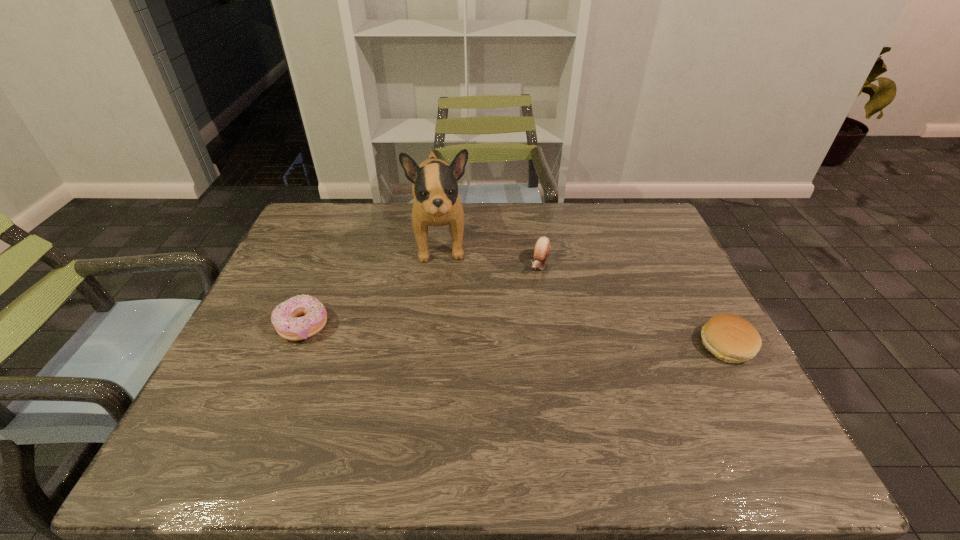
The width and height of the screenshot is (960, 540). I want to click on the leftmost object, so click(286, 319).

Locate an element on the screen. This screenshot has height=540, width=960. the rightmost object is located at coordinates (731, 338).

Image resolution: width=960 pixels, height=540 pixels. I want to click on escargot, so click(x=542, y=247).

Locate an element on the screen. Image resolution: width=960 pixels, height=540 pixels. the second tallest object is located at coordinates (542, 247).

Where is `the second object from left to right`? Image resolution: width=960 pixels, height=540 pixels. the second object from left to right is located at coordinates (436, 202).

You are a GUI agent. You are given a task and a screenshot of the screen. Output one action in this format:
    pyautogui.click(x=<x>, y=<y>)
    Task: Click on the puppy
    Image resolution: width=960 pixels, height=540 pixels.
    Given the screenshot: What is the action you would take?
    pyautogui.click(x=436, y=202)

At what (x,y) coordinates should I click in order to perform the action: click on vacant region located on the right of the doughnut. Please return your answer as a coordinate pair (x, y). This screenshot has width=960, height=540. Looking at the image, I should click on click(x=380, y=326).

The width and height of the screenshot is (960, 540). Find the location of `vacant space located on the left of the rightmost object`. vacant space located on the left of the rightmost object is located at coordinates (567, 345).

The height and width of the screenshot is (540, 960). Identify the location of free region located 0.050m on the front-facing side of the second object from right to left. (532, 288).

This screenshot has height=540, width=960. In order to click on vacant space situated on the front-facing side of the second object from right to left in this screenshot , I will do `click(511, 334)`.